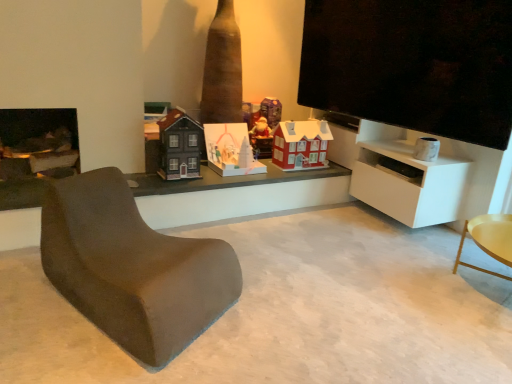
Question: In the image, is white matte cabinet at right positioned in front of or behind matte white paper house at center, acting as the 3th toy starting from the right?

Choices:
 (A) front
 (B) behind

Answer: (A)

Question: From the image's perspective, is white matte cabinet at right above or below matte white paper house at center, acting as the second toy starting from the left?

Choices:
 (A) below
 (B) above

Answer: (A)

Question: Estimate the real-world distances between objects in this image. Which object is farther from the matte black house at center, positioned as the 4th toy in right-to-left order?

Choices:
 (A) matte brown chair at lower left
 (B) white matte cabinet at right
 (C) matte red house at center, the first toy positioned from the right
 (D) matte red house at center, placed as the third toy when sorted from left to right
 (E) matte white paper house at center, acting as the second toy starting from the left

Answer: (B)

Question: Which object is the farthest from the matte red house at center, placed as the third toy when sorted from left to right?

Choices:
 (A) matte red house at center, acting as the 4th toy starting from the left
 (B) white matte cabinet at right
 (C) matte white paper house at center, acting as the second toy starting from the left
 (D) matte black house at center, marked as the first toy in a left-to-right arrangement
 (E) matte brown chair at lower left

Answer: (E)